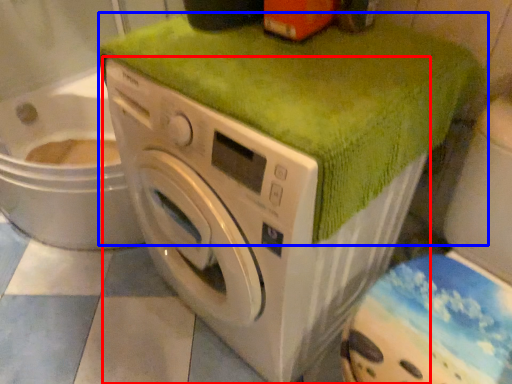
Question: Which object is further to the camera taking this photo, washing machine (highlighted by a red box) or bath towel (highlighted by a blue box)?

Choices:
 (A) washing machine
 (B) bath towel

Answer: (B)